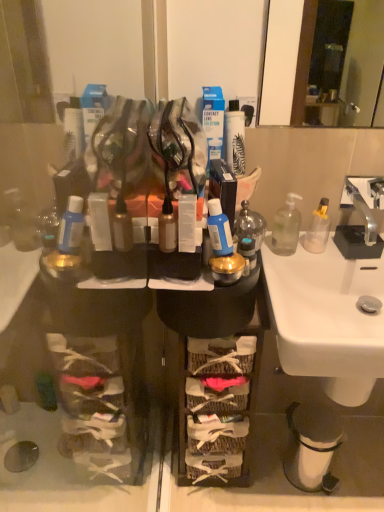
Question: In terms of size, does translucent plastic bottle at center, positioned as the 1th toiletry in right-to-left order, appear bigger or smaller than matte plastic container at center, arranged as the 1th toiletry when viewed from the left?

Choices:
 (A) small
 (B) big

Answer: (B)

Question: From a real-world perspective, is translucent plastic bottle at center, positioned as the 1th toiletry in right-to-left order, above or below matte plastic container at center, arranged as the 1th toiletry when viewed from the left?

Choices:
 (A) above
 (B) below

Answer: (B)

Question: Which object is positioned farthest from the woven baskets at center?

Choices:
 (A) translucent plastic bottle at center, the 3th toiletry in the left-to-right sequence
 (B) white ceramic sink at lower right
 (C) matte plastic container at center, arranged as the 1th toiletry when viewed from the left
 (D) blue matte bottle at center, which is counted as the 2th toiletry, starting from the right
 (E) clear plastic bottle at right, the third bottle positioned from the left

Answer: (C)

Question: Estimate the real-world distances between objects in this image. Which object is closer to the blue matte bottle at center, which ranks as the second toiletry in left-to-right order?

Choices:
 (A) matte plastic container at center, the third toiletry in the right-to-left sequence
 (B) transparent glass soap dispenser at right, acting as the 2th bottle starting from the right
 (C) white ceramic sink at lower right
 (D) translucent glass bottle at center, acting as the third bottle starting from the right
 (E) translucent plastic bottle at center, the 3th toiletry in the left-to-right sequence

Answer: (E)